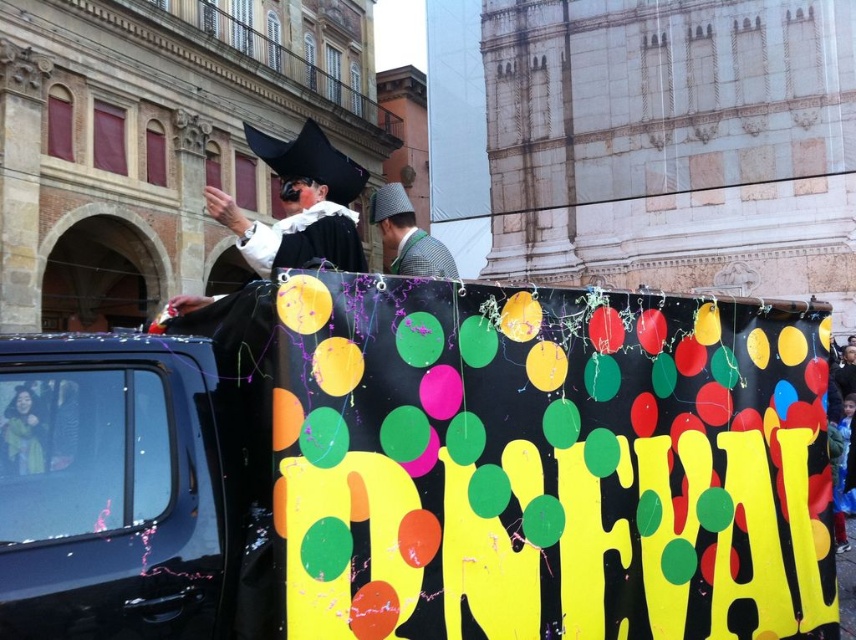
Question: Which object is the closest to the matte black costume at center?

Choices:
 (A) checkered fabric hat at center
 (B) glossy blue car at left
 (C) satin black robe at center

Answer: (B)

Question: Which object is positioned farthest from the satin black robe at center?

Choices:
 (A) checkered fabric hat at center
 (B) matte black costume at center
 (C) glossy blue car at left

Answer: (A)

Question: Which of the following is the farthest from the observer?

Choices:
 (A) (186, 301)
 (B) (378, 204)

Answer: (B)

Question: Considering the relative positions of matte black costume at center and satin black robe at center in the image provided, where is matte black costume at center located with respect to satin black robe at center?

Choices:
 (A) below
 (B) above

Answer: (B)

Question: Is matte black costume at center to the right of satin black robe at center from the viewer's perspective?

Choices:
 (A) yes
 (B) no

Answer: (B)

Question: Is glossy blue car at left above matte black costume at center?

Choices:
 (A) no
 (B) yes

Answer: (A)